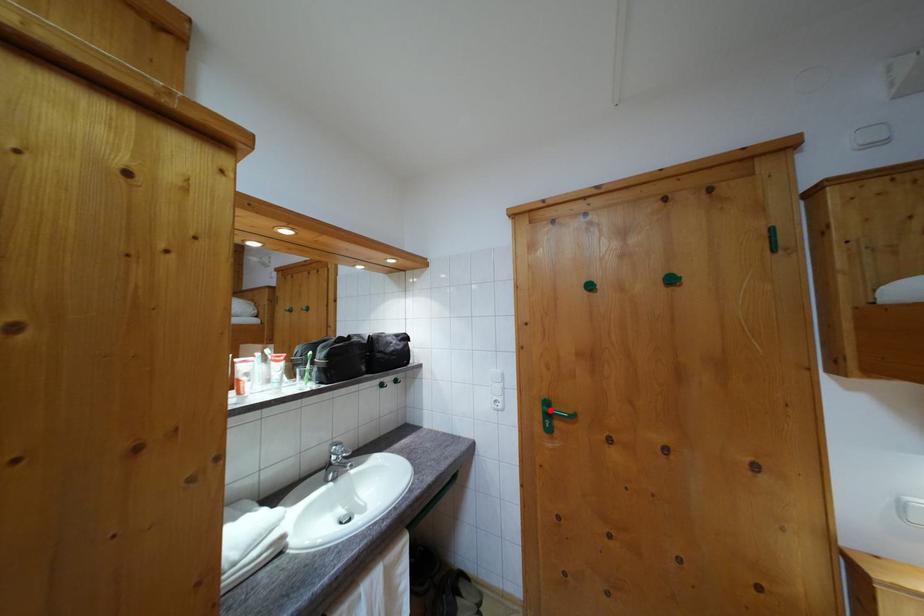
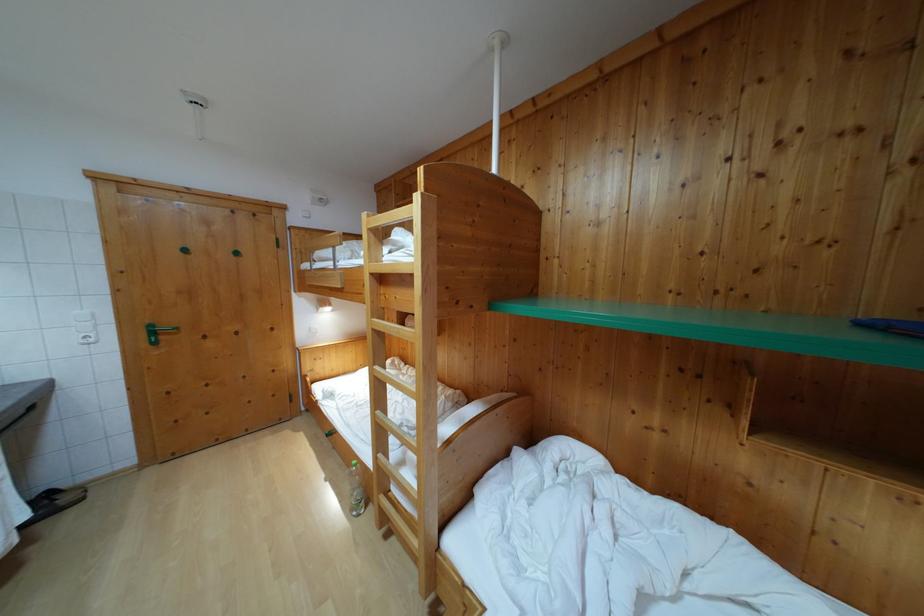
Find the pixel in the second image that matches the highlighted location in the first image.

(155, 333)